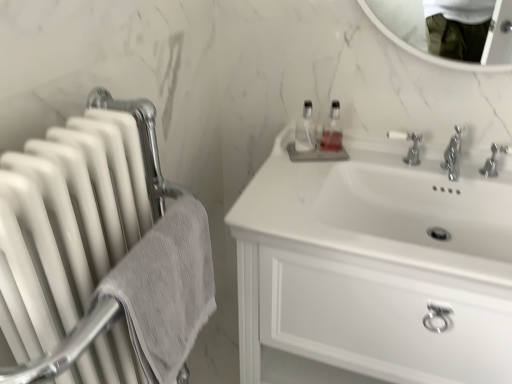
Question: Is white glossy radiator at left to the right of gray textured towel at left from the viewer's perspective?

Choices:
 (A) yes
 (B) no

Answer: (B)

Question: From the image's perspective, does white glossy radiator at left appear higher than gray textured towel at left?

Choices:
 (A) no
 (B) yes

Answer: (A)

Question: Can you confirm if white glossy radiator at left is bigger than gray textured towel at left?

Choices:
 (A) yes
 (B) no

Answer: (A)

Question: Is gray textured towel at left inside white glossy radiator at left?

Choices:
 (A) yes
 (B) no

Answer: (A)

Question: Considering the relative sizes of white glossy radiator at left and gray textured towel at left in the image provided, is white glossy radiator at left smaller than gray textured towel at left?

Choices:
 (A) yes
 (B) no

Answer: (B)

Question: In terms of size, does white glossy radiator at left appear bigger or smaller than clear glass bottle at center?

Choices:
 (A) big
 (B) small

Answer: (A)

Question: From their relative heights in the image, would you say white glossy radiator at left is taller or shorter than clear glass bottle at center?

Choices:
 (A) tall
 (B) short

Answer: (A)

Question: Which is correct: white glossy radiator at left is inside clear glass bottle at center, or outside of it?

Choices:
 (A) inside
 (B) outside

Answer: (B)

Question: Relative to clear glass bottle at center, is white glossy radiator at left in front or behind?

Choices:
 (A) front
 (B) behind

Answer: (A)

Question: Is polished chrome faucet at center right, which ranks as the second tap in left-to-right order, in front of or behind silver metallic tap at upper center, which ranks as the 1th tap in left-to-right order, in the image?

Choices:
 (A) front
 (B) behind

Answer: (A)

Question: Considering the positions of point (489, 167) and point (416, 147), is point (489, 167) closer or farther from the camera than point (416, 147)?

Choices:
 (A) farther
 (B) closer

Answer: (B)

Question: Looking at their shapes, would you say polished chrome faucet at center right, which ranks as the second tap in left-to-right order, is wider or thinner than silver metallic tap at upper center, marked as the second tap in a right-to-left arrangement?

Choices:
 (A) wide
 (B) thin

Answer: (A)

Question: From a real-world perspective, relative to silver metallic tap at upper center, which ranks as the 1th tap in left-to-right order, is polished chrome faucet at center right, the first tap viewed from the right, vertically above or below?

Choices:
 (A) above
 (B) below

Answer: (B)

Question: Relative to silver metallic tap at upper center, which ranks as the 1th tap in left-to-right order, is white glossy cabinet at upper right in front or behind?

Choices:
 (A) behind
 (B) front

Answer: (B)

Question: Is point (331, 301) positioned closer to the camera than point (417, 163)?

Choices:
 (A) farther
 (B) closer

Answer: (B)